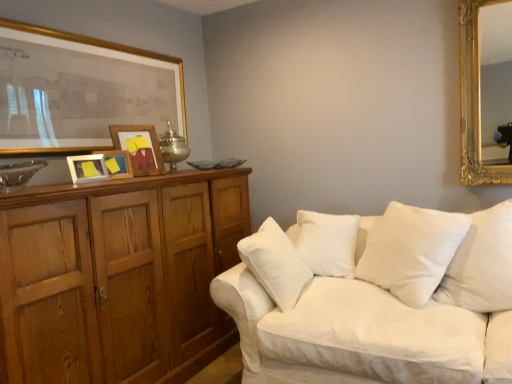
Identify the location of free point above gold-framed picture at upper left, the fourth picture frame positioned from the back (from a real-world perspective). Image resolution: width=512 pixels, height=384 pixels. (90, 29).